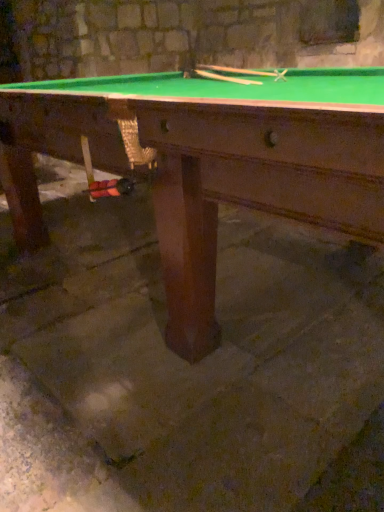
Question: Is wooden smooth cue at upper center, acting as the first cue starting from the left, touching wooden smooth cue at upper center, arranged as the 1th cue when viewed from the right?

Choices:
 (A) no
 (B) yes

Answer: (A)

Question: Is wooden smooth cue at upper center, which is the 2th cue in right-to-left order, positioned far away from wooden smooth cue at upper center, arranged as the 1th cue when viewed from the right?

Choices:
 (A) no
 (B) yes

Answer: (A)

Question: Does wooden smooth cue at upper center, acting as the first cue starting from the left, have a lesser width compared to wooden smooth cue at upper center, arranged as the 1th cue when viewed from the right?

Choices:
 (A) yes
 (B) no

Answer: (A)

Question: Is wooden smooth cue at upper center, acting as the first cue starting from the left, positioned with its back to wooden smooth cue at upper center, positioned as the 2th cue in left-to-right order?

Choices:
 (A) yes
 (B) no

Answer: (B)

Question: Does wooden smooth cue at upper center, which is the 2th cue in right-to-left order, come in front of wooden smooth cue at upper center, arranged as the 1th cue when viewed from the right?

Choices:
 (A) no
 (B) yes

Answer: (B)

Question: From the image's perspective, would you say wooden smooth cue at upper center, acting as the first cue starting from the left, is positioned over wooden smooth cue at upper center, arranged as the 1th cue when viewed from the right?

Choices:
 (A) no
 (B) yes

Answer: (A)

Question: Would you say brown stone concrete at center contains wooden smooth cue at upper center, acting as the first cue starting from the left?

Choices:
 (A) yes
 (B) no

Answer: (A)

Question: Can you confirm if brown stone concrete at center is positioned to the right of wooden smooth cue at upper center, which is the 2th cue in right-to-left order?

Choices:
 (A) no
 (B) yes

Answer: (B)

Question: Can you confirm if brown stone concrete at center is smaller than wooden smooth cue at upper center, acting as the first cue starting from the left?

Choices:
 (A) yes
 (B) no

Answer: (B)

Question: From a real-world perspective, is brown stone concrete at center physically above wooden smooth cue at upper center, acting as the first cue starting from the left?

Choices:
 (A) yes
 (B) no

Answer: (B)

Question: Is brown stone concrete at center looking in the opposite direction of wooden smooth cue at upper center, acting as the first cue starting from the left?

Choices:
 (A) yes
 (B) no

Answer: (B)

Question: Would you consider brown stone concrete at center to be distant from wooden smooth cue at upper center, which is the 2th cue in right-to-left order?

Choices:
 (A) no
 (B) yes

Answer: (B)

Question: Does wooden smooth cue at upper center, positioned as the 2th cue in left-to-right order, have a lesser height compared to brown stone concrete at center?

Choices:
 (A) no
 (B) yes

Answer: (B)